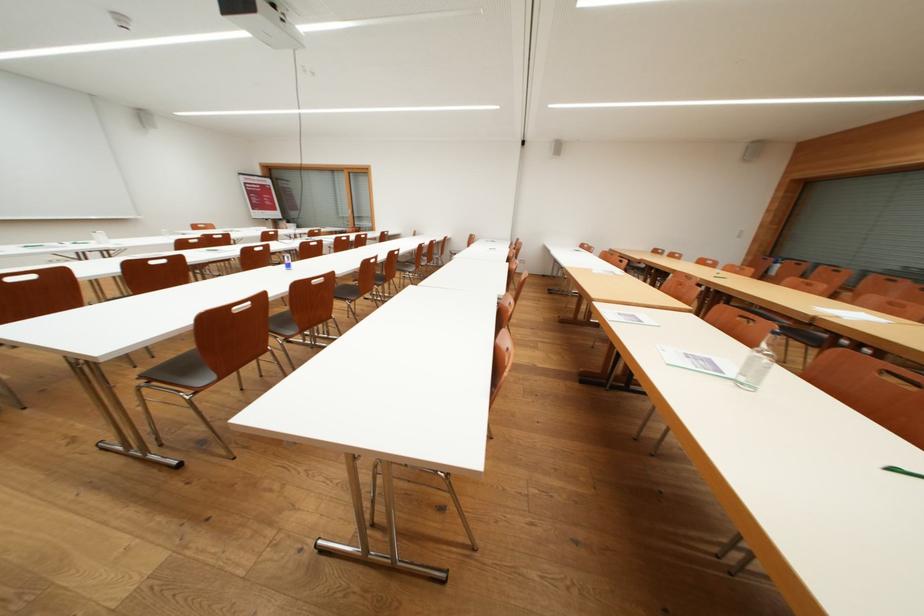
This screenshot has height=616, width=924. I want to click on brown chair handle, so click(x=211, y=358).